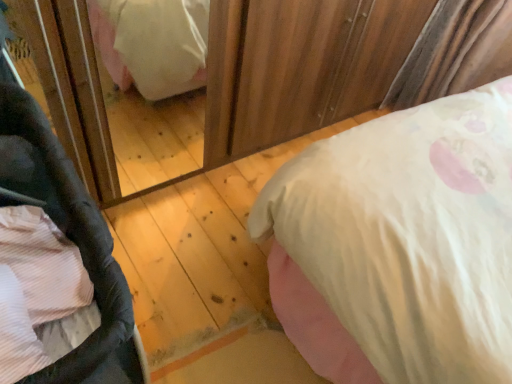
Describe the element at coordinates (83, 258) in the screenshot. The height and width of the screenshot is (384, 512). I see `black fabric baby carriage at lower left` at that location.

Where is `black fabric baby carriage at lower left`? black fabric baby carriage at lower left is located at coordinates (83, 258).

Measure the distance between point (67, 362) and camera.

Point (67, 362) and camera are 24.65 inches apart from each other.

Where is `pink satin bed at lower left`? pink satin bed at lower left is located at coordinates (407, 239).

What do you see at coordinates (407, 239) in the screenshot?
I see `pink satin bed at lower left` at bounding box center [407, 239].

The image size is (512, 384). I want to click on black fabric baby carriage at lower left, so click(x=83, y=258).

Which is more to the left, black fabric baby carriage at lower left or pink satin bed at lower left?

black fabric baby carriage at lower left is more to the left.

Considering their positions, is black fabric baby carriage at lower left located in front of or behind pink satin bed at lower left?

black fabric baby carriage at lower left is positioned closer to the viewer than pink satin bed at lower left.

Between point (32, 111) and point (458, 200), which one is positioned behind?

Positioned behind is point (458, 200).

From the image's perspective, between black fabric baby carriage at lower left and pink satin bed at lower left, who is located below?

From the image's view, black fabric baby carriage at lower left is below.

From a real-world perspective, is black fabric baby carriage at lower left over pink satin bed at lower left?

Yes, from a real-world perspective, black fabric baby carriage at lower left is over pink satin bed at lower left

Does black fabric baby carriage at lower left have a greater width compared to pink satin bed at lower left?

No, black fabric baby carriage at lower left is not wider than pink satin bed at lower left.

Is black fabric baby carriage at lower left taller or shorter than pink satin bed at lower left?

In the image, black fabric baby carriage at lower left appears to be taller than pink satin bed at lower left.

In the scene shown: Can you confirm if black fabric baby carriage at lower left is smaller than pink satin bed at lower left?

Actually, black fabric baby carriage at lower left might be larger than pink satin bed at lower left.

Which is correct: black fabric baby carriage at lower left is inside pink satin bed at lower left, or outside of it?

black fabric baby carriage at lower left exists outside the volume of pink satin bed at lower left.

Based on the photo, is black fabric baby carriage at lower left beside pink satin bed at lower left?

black fabric baby carriage at lower left and pink satin bed at lower left are not in contact.

Is black fabric baby carriage at lower left aimed at pink satin bed at lower left?

No, black fabric baby carriage at lower left is not turned towards pink satin bed at lower left.

How different are the orientations of black fabric baby carriage at lower left and pink satin bed at lower left in degrees?

The angle between the facing direction of black fabric baby carriage at lower left and the facing direction of pink satin bed at lower left is 0.686 degrees.

Find the location of `baby carriage in front of the pink satin bed at lower left`. baby carriage in front of the pink satin bed at lower left is located at coordinates (83, 258).

Considering the relative positions of pink satin bed at lower left and black fabric baby carriage at lower left in the image provided, is pink satin bed at lower left to the left of black fabric baby carriage at lower left from the viewer's perspective?

Incorrect, pink satin bed at lower left is not on the left side of black fabric baby carriage at lower left.

In the image, is pink satin bed at lower left positioned in front of or behind black fabric baby carriage at lower left?

pink satin bed at lower left is positioned farther from the viewer than black fabric baby carriage at lower left.

Considering the positions of points (399, 278) and (99, 371), is point (399, 278) closer to camera compared to point (99, 371)?

No, (399, 278) is behind (99, 371).

From the image's perspective, between pink satin bed at lower left and black fabric baby carriage at lower left, which one is located above?

From the image's view, pink satin bed at lower left is above.

From a real-world perspective, does pink satin bed at lower left stand above black fabric baby carriage at lower left?

Actually, pink satin bed at lower left is physically below black fabric baby carriage at lower left in the real world.

Is pink satin bed at lower left wider or thinner than black fabric baby carriage at lower left?

Clearly, pink satin bed at lower left has more width compared to black fabric baby carriage at lower left.

Considering the sizes of objects pink satin bed at lower left and black fabric baby carriage at lower left in the image provided, who is shorter, pink satin bed at lower left or black fabric baby carriage at lower left?

Standing shorter between the two is pink satin bed at lower left.

Which of these two, pink satin bed at lower left or black fabric baby carriage at lower left, is smaller?

With smaller size is pink satin bed at lower left.

Is pink satin bed at lower left positioned beyond the bounds of black fabric baby carriage at lower left?

Yes, pink satin bed at lower left is not within black fabric baby carriage at lower left.

Are pink satin bed at lower left and black fabric baby carriage at lower left beside each other?

pink satin bed at lower left and black fabric baby carriage at lower left are clearly separated.

Based on the photo, could you tell me if pink satin bed at lower left is facing black fabric baby carriage at lower left?

No, pink satin bed at lower left is not turned towards black fabric baby carriage at lower left.

What's the angular difference between pink satin bed at lower left and black fabric baby carriage at lower left's facing directions?

They differ by 0.686 degrees in their facing directions.

How much distance is there between pink satin bed at lower left and black fabric baby carriage at lower left?

A: They are 26.16 inches apart.

Find the location of a particular element. The width and height of the screenshot is (512, 384). bed below the black fabric baby carriage at lower left (from a real-world perspective) is located at coordinates (407, 239).

Find the location of a particular element. The height and width of the screenshot is (384, 512). bed that is above the black fabric baby carriage at lower left (from the image's perspective) is located at coordinates (407, 239).

Find the location of a particular element. The width and height of the screenshot is (512, 384). bed directly beneath the black fabric baby carriage at lower left (from a real-world perspective) is located at coordinates (407, 239).